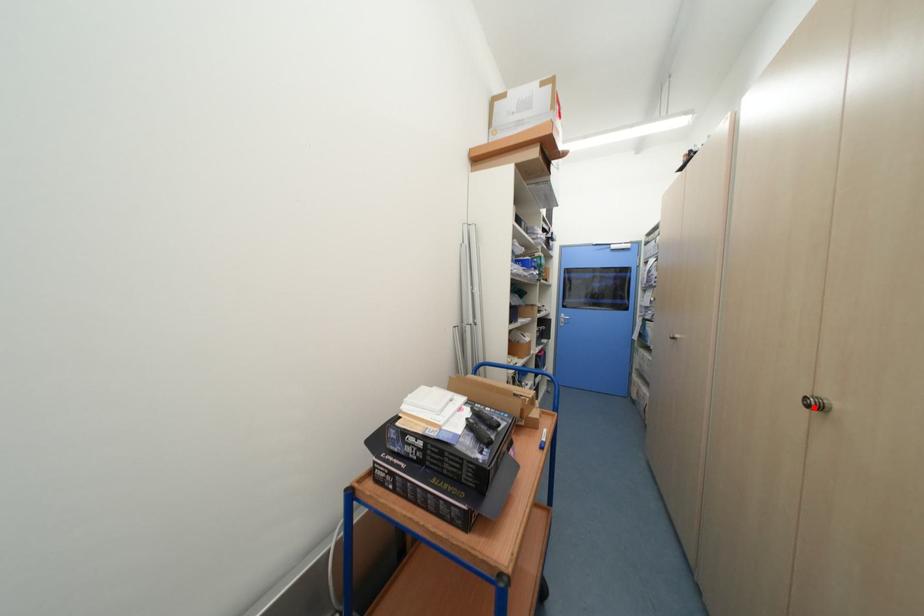
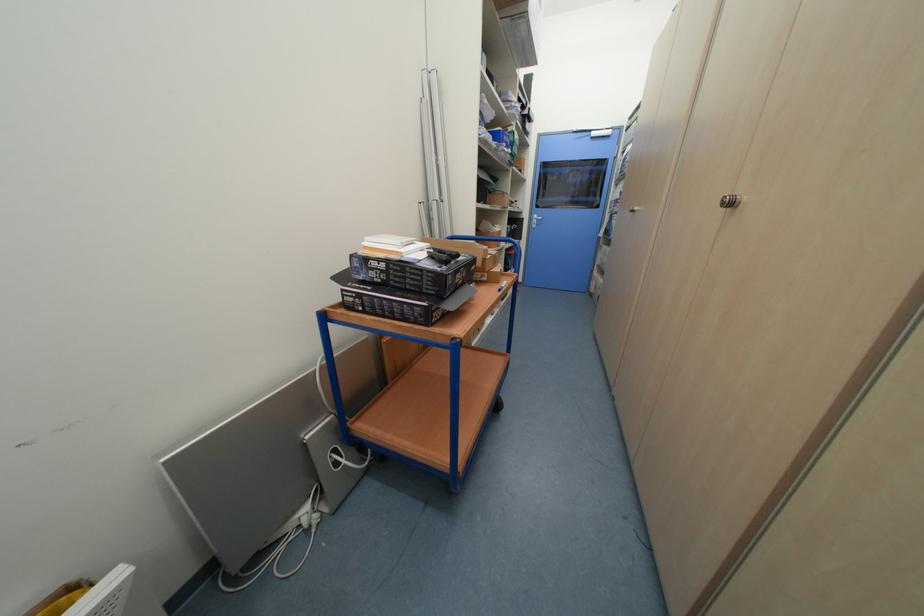
Where in the second image is the point corresponding to the highlighted location from the first image?

(728, 206)